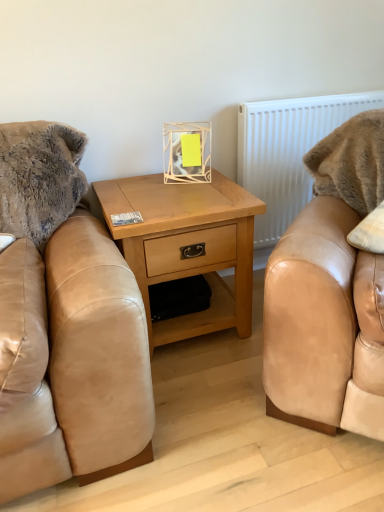
Question: Does white plastic radiator at upper right touch light wood/texture nightstand at center?

Choices:
 (A) yes
 (B) no

Answer: (B)

Question: From a real-world perspective, is white plastic radiator at upper right positioned under light wood/texture nightstand at center based on gravity?

Choices:
 (A) yes
 (B) no

Answer: (B)

Question: Does white plastic radiator at upper right come behind light wood/texture nightstand at center?

Choices:
 (A) no
 (B) yes

Answer: (B)

Question: Can you confirm if white plastic radiator at upper right is positioned to the left of light wood/texture nightstand at center?

Choices:
 (A) no
 (B) yes

Answer: (A)

Question: Does white plastic radiator at upper right have a greater height compared to light wood/texture nightstand at center?

Choices:
 (A) yes
 (B) no

Answer: (A)

Question: Is white plastic radiator at upper right wider than light wood/texture nightstand at center?

Choices:
 (A) yes
 (B) no

Answer: (B)

Question: From a real-world perspective, is light wood/texture nightstand at center physically above white plastic radiator at upper right?

Choices:
 (A) yes
 (B) no

Answer: (B)

Question: Would you say white plastic radiator at upper right is part of light wood/texture nightstand at center's contents?

Choices:
 (A) no
 (B) yes

Answer: (A)

Question: Considering the relative sizes of light wood/texture nightstand at center and white plastic radiator at upper right in the image provided, is light wood/texture nightstand at center taller than white plastic radiator at upper right?

Choices:
 (A) no
 (B) yes

Answer: (A)

Question: Is light wood/texture nightstand at center turned away from white plastic radiator at upper right?

Choices:
 (A) yes
 (B) no

Answer: (B)

Question: From the image's perspective, does light wood/texture nightstand at center appear higher than white plastic radiator at upper right?

Choices:
 (A) no
 (B) yes

Answer: (A)

Question: From a real-world perspective, is light wood/texture nightstand at center positioned under white plastic radiator at upper right based on gravity?

Choices:
 (A) yes
 (B) no

Answer: (A)

Question: Based on their sizes in the image, would you say white plastic radiator at upper right is bigger or smaller than light wood/texture nightstand at center?

Choices:
 (A) big
 (B) small

Answer: (B)